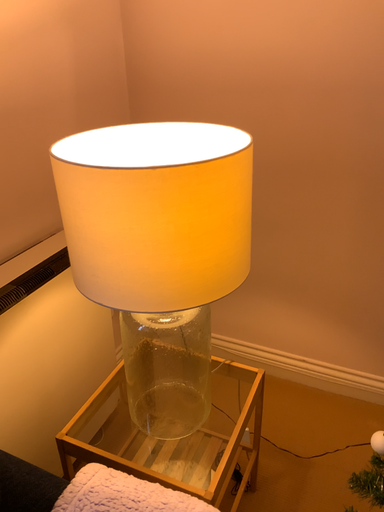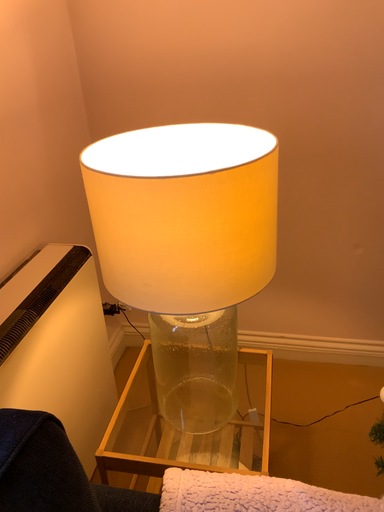
Question: How did the camera likely rotate when shooting the video?

Choices:
 (A) rotated left
 (B) rotated right

Answer: (B)